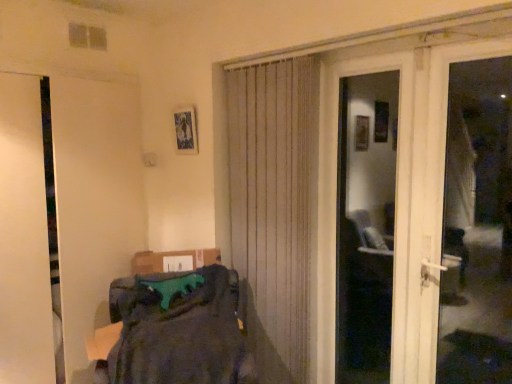
Locate an element on the screen. The width and height of the screenshot is (512, 384). blank space situated above beige textured curtain at center (from a real-world perspective) is located at coordinates (272, 60).